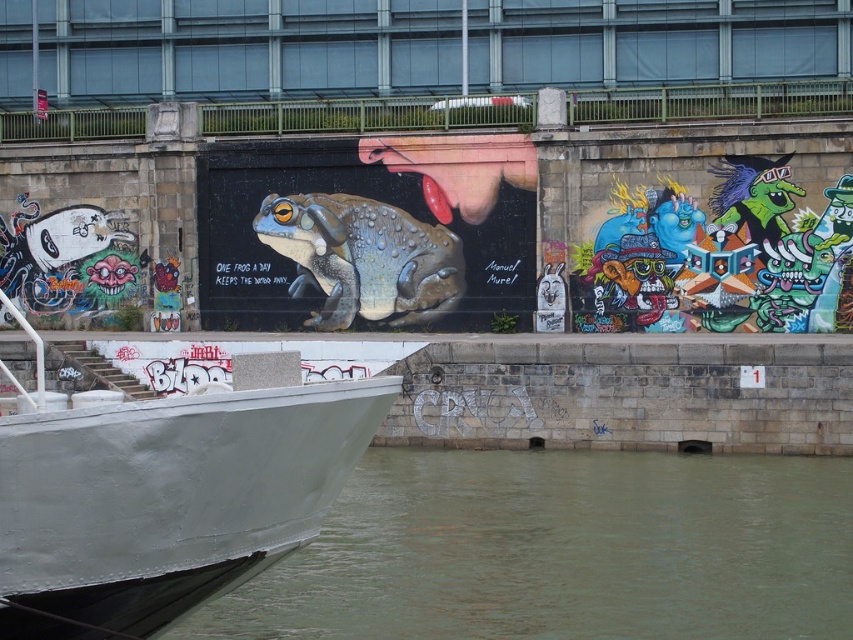
You are standing at the center of the image. Which direction should you move to reach the greenish water at lower left?

The greenish water at lower left is located at point [563,550], so you should move towards the lower left direction to reach it.